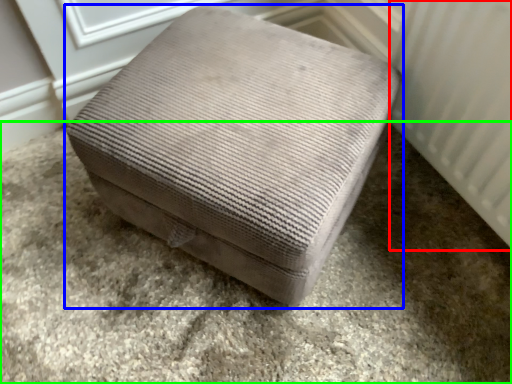
Question: Based on their relative distances, which object is nearer to radiator (highlighted by a red box)? Choose from furniture (highlighted by a blue box) and concrete (highlighted by a green box).

Choices:
 (A) furniture
 (B) concrete

Answer: (A)